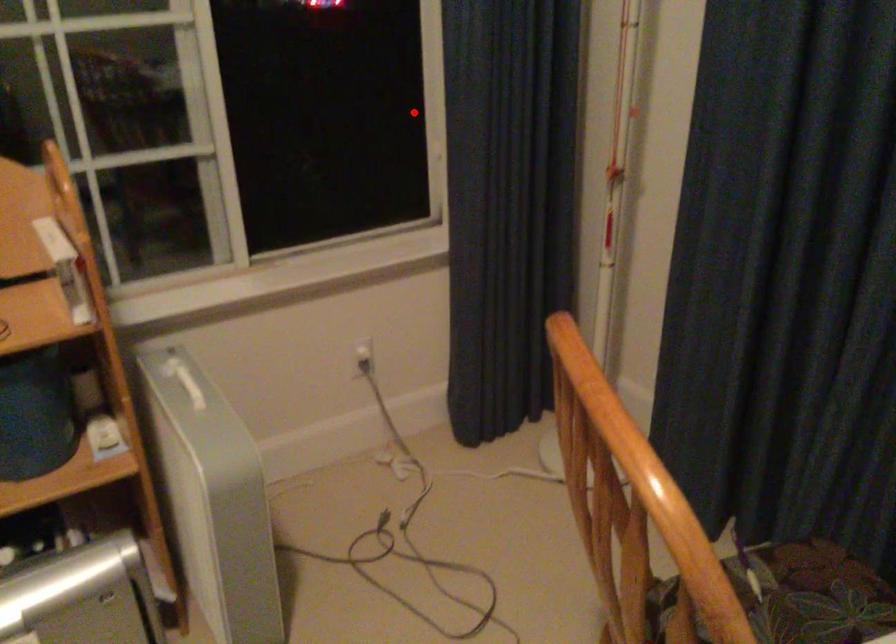
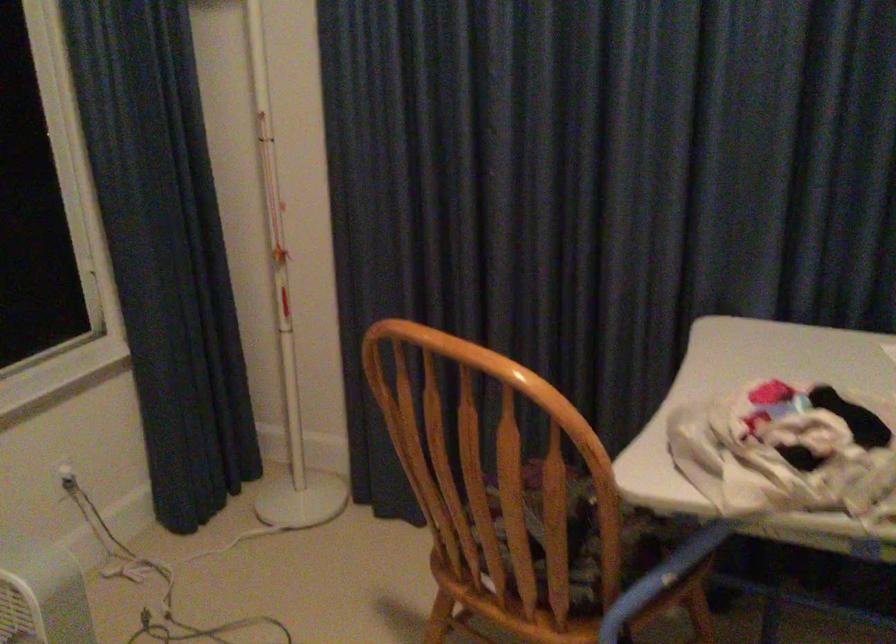
The point at the highlighted location is marked in the first image. Where is the corresponding point in the second image?

(66, 230)